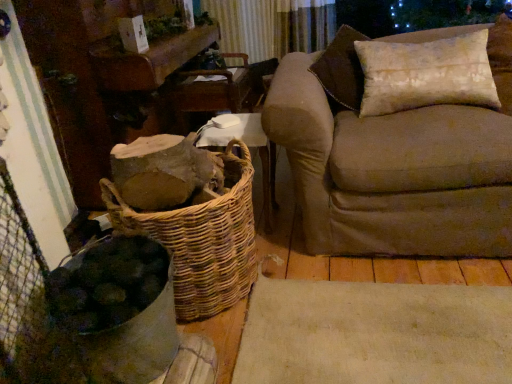
At what (x,y) coordinates should I click in order to perform the action: click on vacant area located to the right-hand side of woven brown basket at lower left. Please return your answer as a coordinate pair (x, y). Looking at the image, I should click on (326, 290).